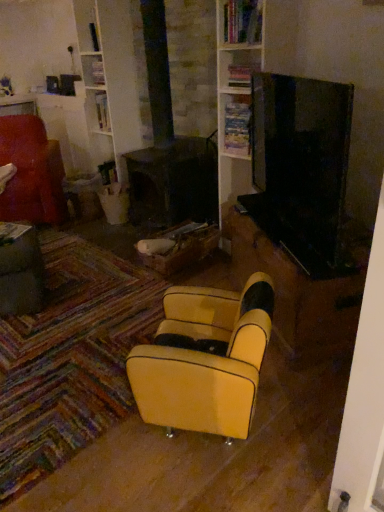
What are the coordinates of `free space in front of metallic gray table at lower left` in the screenshot? It's located at (40, 334).